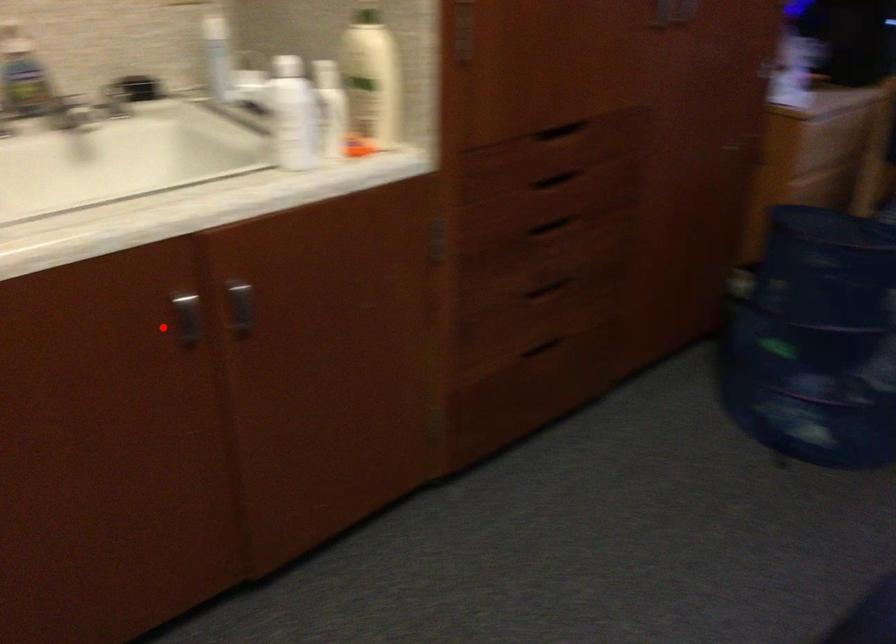
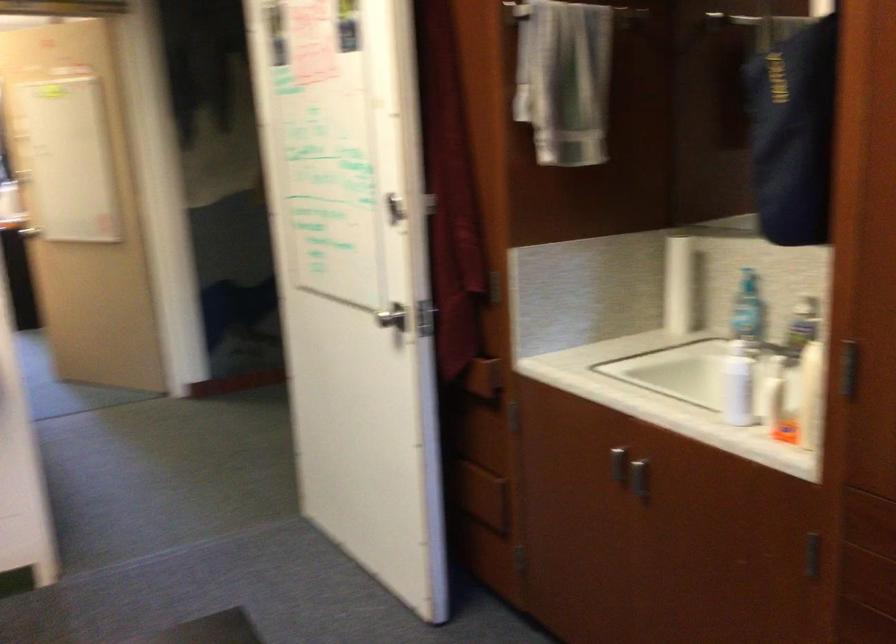
In the second image, find the point that corresponds to the highlighted location in the first image.

(618, 464)